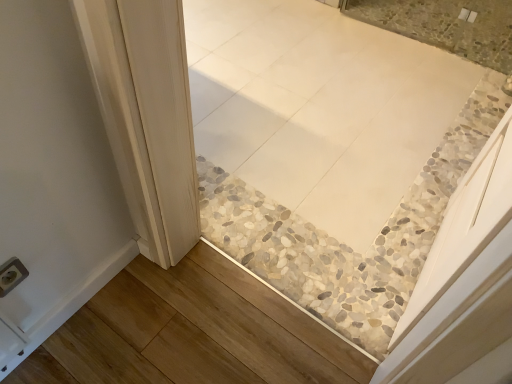
What is the approximate width of white plastic electric outlet at lower left?

white plastic electric outlet at lower left is 1.46 centimeters in width.

Where is `white plastic electric outlet at lower left`? This screenshot has width=512, height=384. white plastic electric outlet at lower left is located at coordinates (11, 275).

What do you see at coordinates (11, 275) in the screenshot? The image size is (512, 384). I see `white plastic electric outlet at lower left` at bounding box center [11, 275].

What is the approximate height of white glossy tile at upper center?

The height of white glossy tile at upper center is 5.25 centimeters.

Find the location of `white glossy tile at upper center`. white glossy tile at upper center is located at coordinates (446, 25).

The height and width of the screenshot is (384, 512). What do you see at coordinates (446, 25) in the screenshot?
I see `white glossy tile at upper center` at bounding box center [446, 25].

Locate an element on the screen. The height and width of the screenshot is (384, 512). white plastic electric outlet at lower left is located at coordinates (11, 275).

Which object is positioned more to the right, white glossy tile at upper center or white plastic electric outlet at lower left?

white glossy tile at upper center.

Is white glossy tile at upper center in front of or behind white plastic electric outlet at lower left in the image?

white glossy tile at upper center is positioned farther from the viewer than white plastic electric outlet at lower left.

Which is behind, point (414, 31) or point (7, 286)?

Point (414, 31)

From the image's perspective, between white glossy tile at upper center and white plastic electric outlet at lower left, which one is located above?

white glossy tile at upper center appears higher in the image.

From a real-world perspective, is white glossy tile at upper center physically below white plastic electric outlet at lower left?

Indeed, from a real-world perspective, white glossy tile at upper center is positioned beneath white plastic electric outlet at lower left.

Is white glossy tile at upper center thinner than white plastic electric outlet at lower left?

In fact, white glossy tile at upper center might be wider than white plastic electric outlet at lower left.

Can you confirm if white glossy tile at upper center is taller than white plastic electric outlet at lower left?

In fact, white glossy tile at upper center may be shorter than white plastic electric outlet at lower left.

Considering the sizes of white glossy tile at upper center and white plastic electric outlet at lower left in the image, is white glossy tile at upper center bigger or smaller than white plastic electric outlet at lower left?

In the image, white glossy tile at upper center appears to be larger than white plastic electric outlet at lower left.

Is white glossy tile at upper center inside or outside of white plastic electric outlet at lower left?

white glossy tile at upper center exists outside the volume of white plastic electric outlet at lower left.

Would you consider white glossy tile at upper center to be distant from white plastic electric outlet at lower left?

Yes.

Is white plastic electric outlet at lower left at the back of white glossy tile at upper center?

No.

The width and height of the screenshot is (512, 384). I want to click on electric outlet in front of the white glossy tile at upper center, so click(x=11, y=275).

Is white plastic electric outlet at lower left at the left side of white glossy tile at upper center?

Yes, white plastic electric outlet at lower left is to the left of white glossy tile at upper center.

Consider the image. Considering the relative positions of white plastic electric outlet at lower left and white glossy tile at upper center in the image provided, is white plastic electric outlet at lower left behind white glossy tile at upper center?

No, white plastic electric outlet at lower left is closer to the camera.

Between point (4, 288) and point (412, 7), which one is positioned behind?

The point (412, 7) is farther.

From the image's perspective, is white plastic electric outlet at lower left on white glossy tile at upper center?

No, from the image's perspective, white plastic electric outlet at lower left is not on top of white glossy tile at upper center.

From a real-world perspective, who is located higher, white plastic electric outlet at lower left or white glossy tile at upper center?

white plastic electric outlet at lower left.

From the picture: Is white plastic electric outlet at lower left wider or thinner than white glossy tile at upper center?

In the image, white plastic electric outlet at lower left appears to be more narrow than white glossy tile at upper center.

Between white plastic electric outlet at lower left and white glossy tile at upper center, which one has less height?

With less height is white glossy tile at upper center.

Which of these two, white plastic electric outlet at lower left or white glossy tile at upper center, is bigger?

With larger size is white glossy tile at upper center.

Does white plastic electric outlet at lower left contain white glossy tile at upper center?

That's incorrect, white glossy tile at upper center is not inside white plastic electric outlet at lower left.

Is the surface of white plastic electric outlet at lower left in direct contact with white glossy tile at upper center?

They are not placed beside each other.

Could you tell me if white plastic electric outlet at lower left is facing white glossy tile at upper center?

No, white plastic electric outlet at lower left is not oriented towards white glossy tile at upper center.

How different are the orientations of white plastic electric outlet at lower left and white glossy tile at upper center in degrees?

The facing directions of white plastic electric outlet at lower left and white glossy tile at upper center are 89.1 degrees apart.

The width and height of the screenshot is (512, 384). Identify the location of electric outlet on the left of white glossy tile at upper center. (11, 275).

The width and height of the screenshot is (512, 384). In order to click on electric outlet above the white glossy tile at upper center (from a real-world perspective) in this screenshot , I will do `click(11, 275)`.

Image resolution: width=512 pixels, height=384 pixels. Identify the location of electric outlet on the left of white glossy tile at upper center. (11, 275).